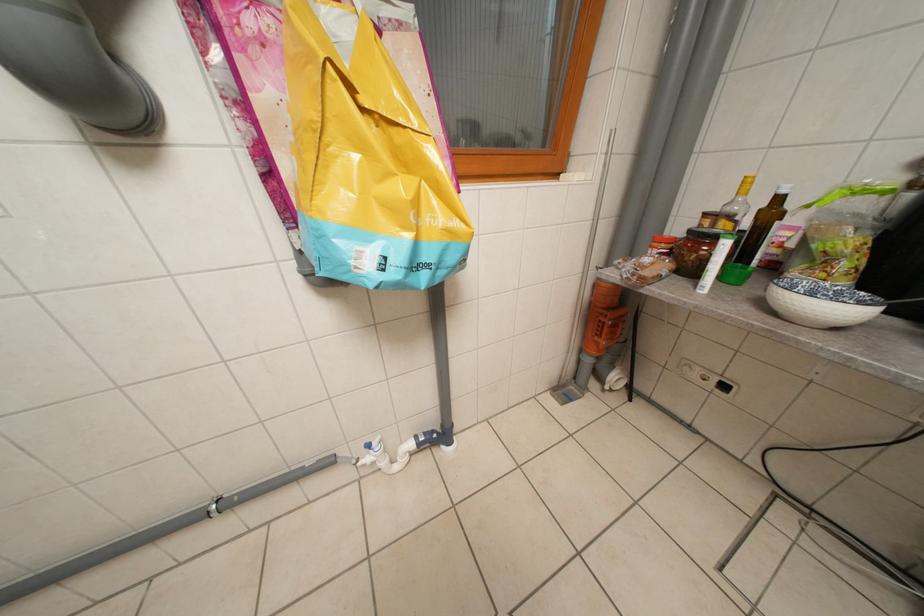
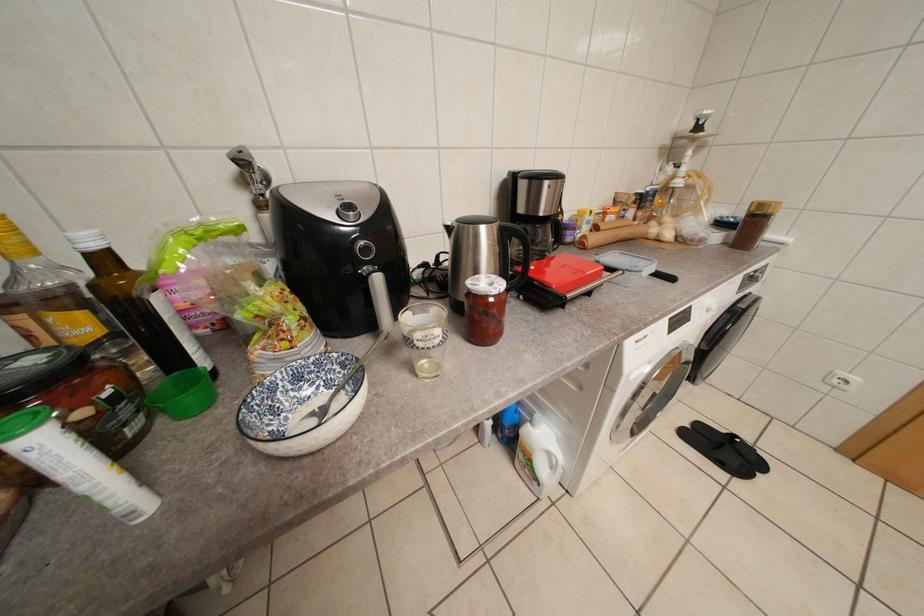
The first image is from the beginning of the video and the second image is from the end. How did the camera likely rotate when shooting the video?

The camera rotated toward right-down.